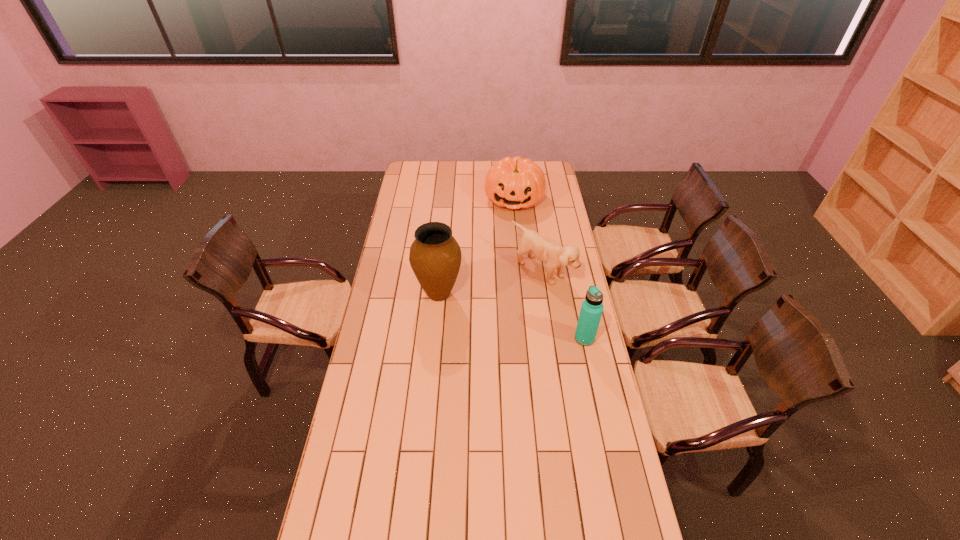
The height and width of the screenshot is (540, 960). What are the coordinates of `vacant spot on the desktop that is between the urn and the nearest object and is positioned on the left side of the puppy` in the screenshot? It's located at (490, 309).

Find the location of a particular element. This screenshot has width=960, height=540. free space on the desktop that is between the tallest object and the nearest object and is positioned on the carved face of the farthest object is located at coordinates (501, 313).